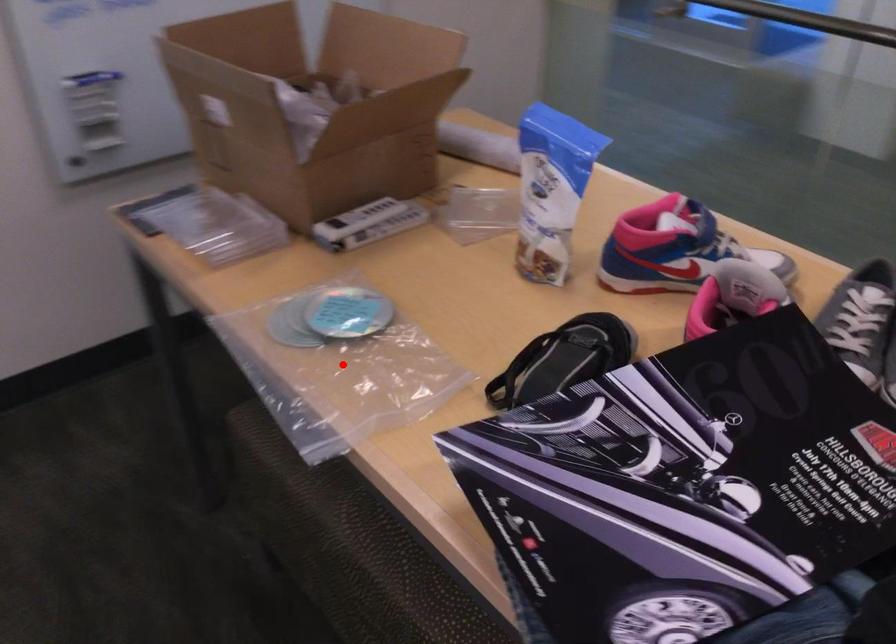
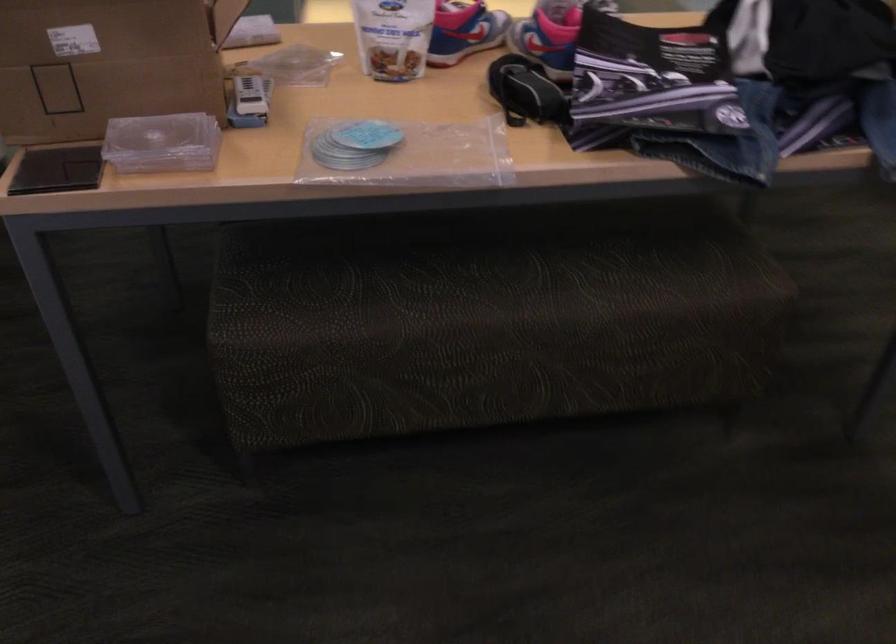
Locate, in the second image, the point that corresponds to the highlighted location in the first image.

(415, 156)